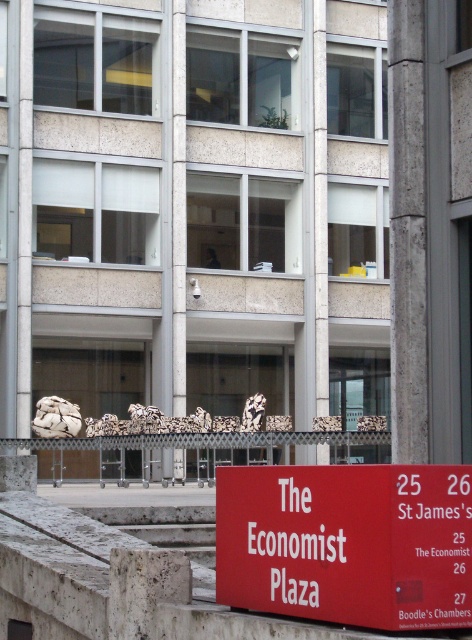
Question: Which of these objects is positioned farthest from the white marble pillar at center?

Choices:
 (A) red matte sign at lower center
 (B) metallic silver rail at center

Answer: (A)

Question: Can you confirm if red matte sign at lower center is positioned to the right of metallic silver rail at center?

Choices:
 (A) no
 (B) yes

Answer: (B)

Question: Which point appears closest to the camera in this image?

Choices:
 (A) (94, 458)
 (B) (262, 520)
 (C) (180, 288)
 (D) (393, 413)

Answer: (B)

Question: Considering the relative positions of red matte sign at lower center and gray concrete pillar at center in the image provided, where is red matte sign at lower center located with respect to gray concrete pillar at center?

Choices:
 (A) below
 (B) above

Answer: (A)

Question: Which of the following is the closest to the observer?

Choices:
 (A) white marble pillar at center
 (B) metallic silver rail at center
 (C) red matte sign at lower center
 (D) gray concrete pillar at center

Answer: (C)

Question: Considering the relative positions of metallic silver rail at center and white marble pillar at center in the image provided, where is metallic silver rail at center located with respect to white marble pillar at center?

Choices:
 (A) left
 (B) right

Answer: (A)